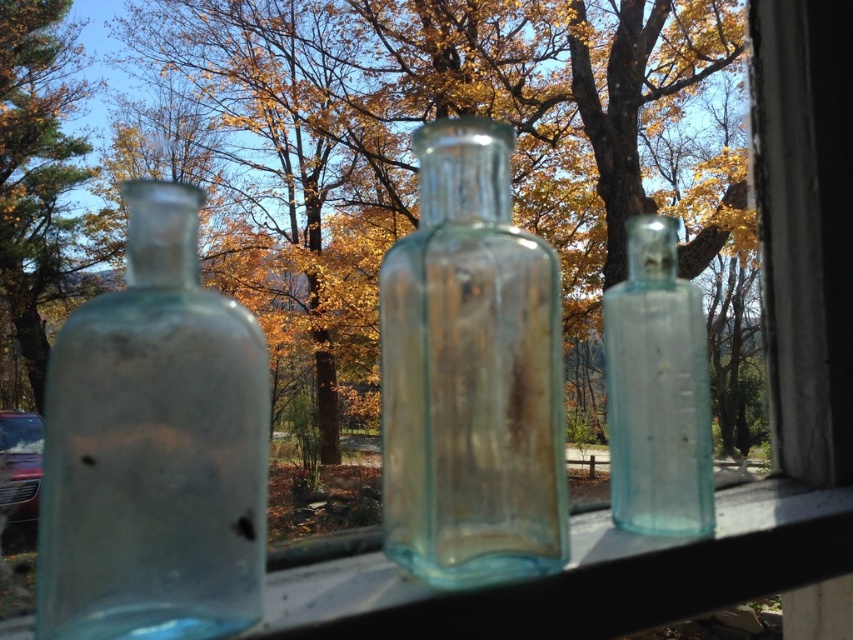
Is transparent glass bottle at center bigger than transparent glass bottle at right?

Correct, transparent glass bottle at center is larger in size than transparent glass bottle at right.

Who is lower down, transparent glass bottle at center or transparent glass bottle at right?

transparent glass bottle at center

I want to click on transparent glass bottle at center, so click(x=471, y=372).

Locate an element on the screen. The image size is (853, 640). transparent glass bottle at center is located at coordinates (471, 372).

Is transparent glass bottle at center shorter than green leafy tree at left?

Indeed, transparent glass bottle at center has a lesser height compared to green leafy tree at left.

Is transparent glass bottle at center in front of green leafy tree at left?

Yes, transparent glass bottle at center is in front of green leafy tree at left.

Image resolution: width=853 pixels, height=640 pixels. Describe the element at coordinates (471, 372) in the screenshot. I see `transparent glass bottle at center` at that location.

Locate an element on the screen. The height and width of the screenshot is (640, 853). transparent glass bottle at center is located at coordinates (471, 372).

At what (x,y) coordinates should I click in order to perform the action: click on transparent glass bottle at left. Please return your answer as a coordinate pair (x, y). The height and width of the screenshot is (640, 853). Looking at the image, I should click on (154, 448).

Looking at this image, can you confirm if transparent glass bottle at left is wider than transparent glass bottle at center?

Yes, transparent glass bottle at left is wider than transparent glass bottle at center.

The image size is (853, 640). Identify the location of transparent glass bottle at left. (154, 448).